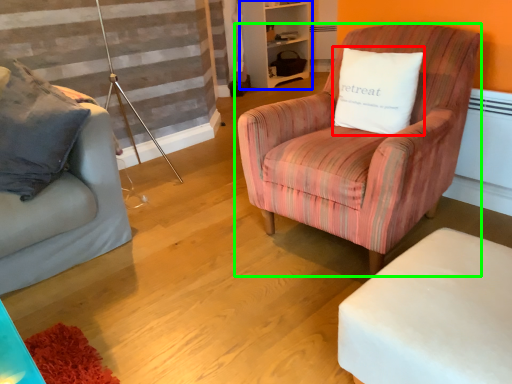
Question: Based on their relative distances, which object is nearer to pillow (highlighted by a red box)? Choose from bookshelf (highlighted by a blue box) and chair (highlighted by a green box).

Choices:
 (A) bookshelf
 (B) chair

Answer: (B)